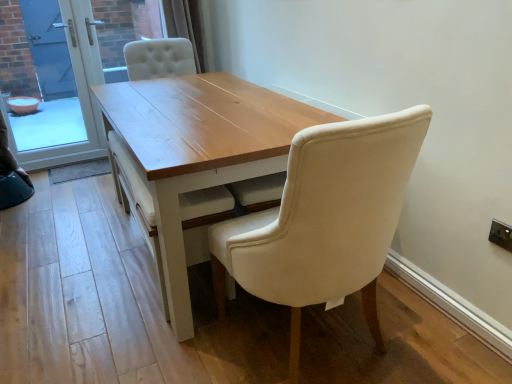
You are a GUI agent. You are given a task and a screenshot of the screen. Output one action in this format:
    pyautogui.click(x=<x>, y=<y>)
    Task: Click on the vacant region to the left of matte cream chair at center
    
    Given the screenshot: What is the action you would take?
    pyautogui.click(x=168, y=352)